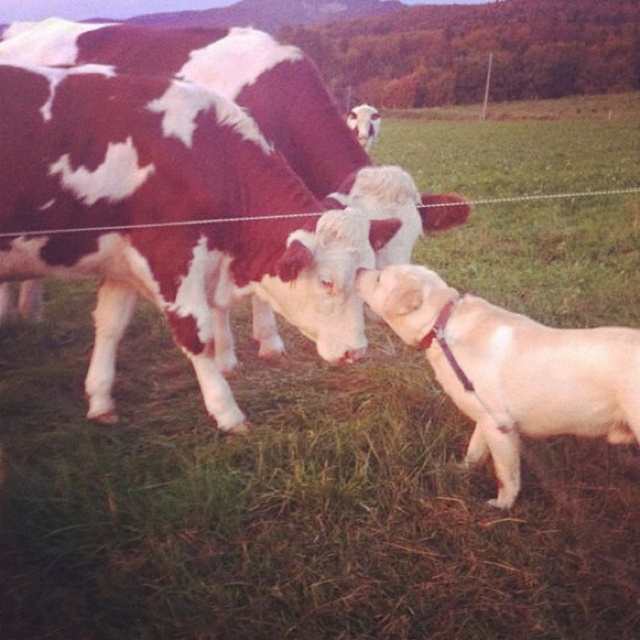
Question: Which point appears closest to the camera in this image?

Choices:
 (A) [x=348, y=118]
 (B) [x=337, y=296]

Answer: (B)

Question: Can you confirm if smooth white dog at center is bigger than white fur dog at center?

Choices:
 (A) yes
 (B) no

Answer: (B)

Question: Can you confirm if smooth white dog at center is smaller than light brown fur at right?

Choices:
 (A) yes
 (B) no

Answer: (B)

Question: Among these points, which one is farthest from the camera?

Choices:
 (A) (296, 321)
 (B) (509, 413)

Answer: (A)

Question: Where is light brown fur at right located in relation to white fur dog at center in the image?

Choices:
 (A) above
 (B) below

Answer: (B)

Question: Which object is farther from the camera taking this photo?

Choices:
 (A) smooth white dog at center
 (B) light brown fur at right
 (C) white fur dog at center

Answer: (C)